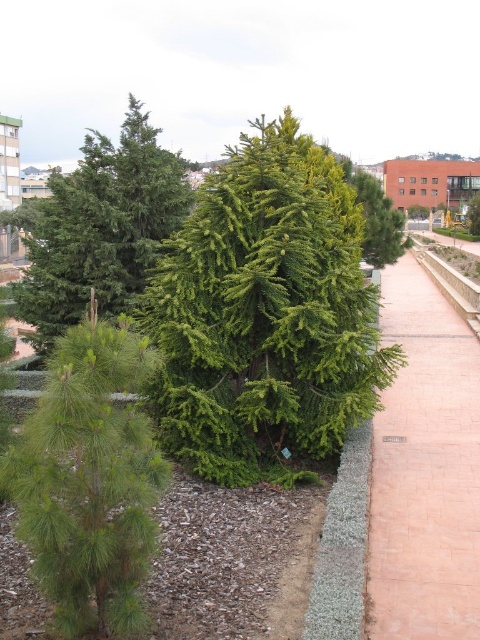
Who is positioned more to the left, green matte pine tree at left or green needle-like at center?

From the viewer's perspective, green needle-like at center appears more on the left side.

Between green matte pine tree at left and green needle-like at center, which one has less height?

With less height is green matte pine tree at left.

Which is behind, point (101, 497) or point (137, 280)?

The point (137, 280) is more distant.

Locate an element on the screen. The image size is (480, 640). green matte pine tree at left is located at coordinates pos(88,481).

Is the position of green matte pine tree at left more distant than that of pink brick pavement at right?

No, green matte pine tree at left is in front of pink brick pavement at right.

Find the location of `green matte pine tree at left`. green matte pine tree at left is located at coordinates (88, 481).

At what (x,y) coordinates should I click in order to perform the action: click on green matte pine tree at left. Please return your answer as a coordinate pair (x, y). Image resolution: width=480 pixels, height=640 pixels. Looking at the image, I should click on (88, 481).

Who is shorter, green leafy tree at center or green matte pine tree at left?

With less height is green matte pine tree at left.

Which is more to the right, green leafy tree at center or green matte pine tree at left?

green leafy tree at center is more to the right.

What do you see at coordinates (264, 316) in the screenshot? I see `green leafy tree at center` at bounding box center [264, 316].

Locate an element on the screen. green leafy tree at center is located at coordinates (264, 316).